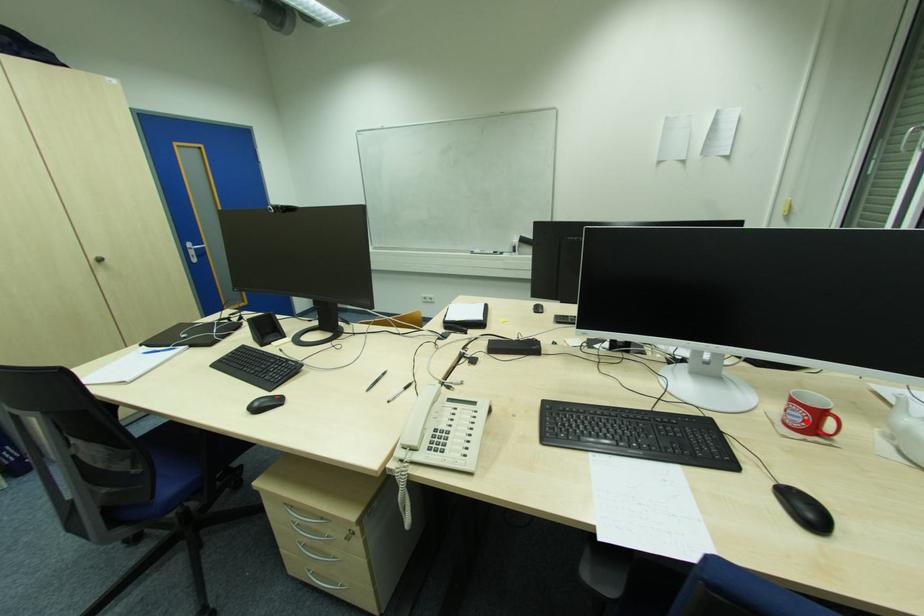
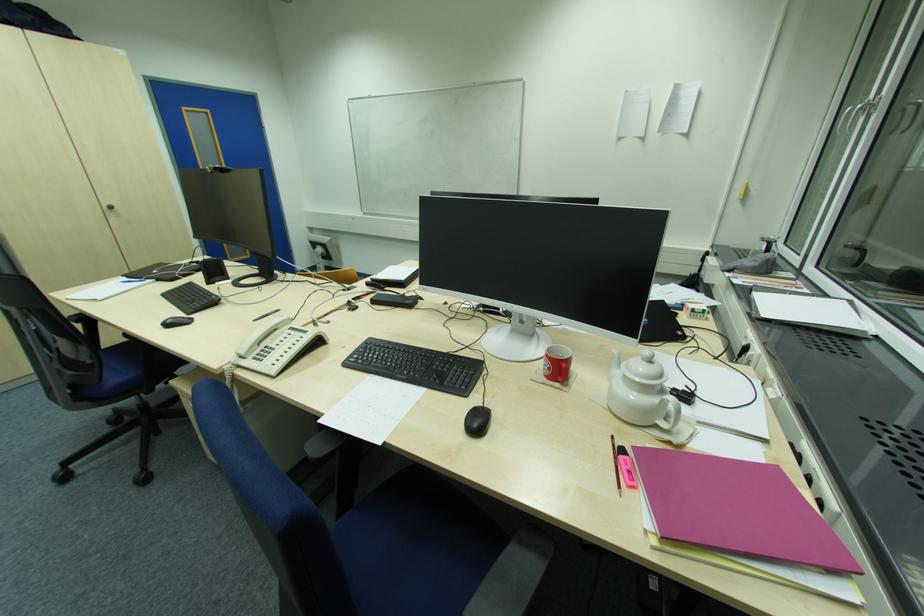
Find the pixel in the second image that matches the highlighted location in the first image.

(551, 370)